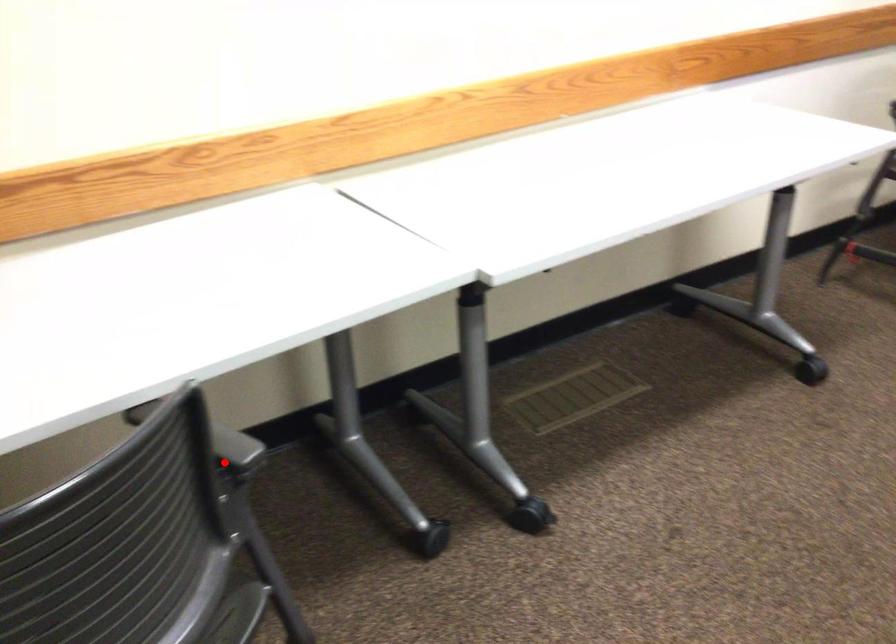
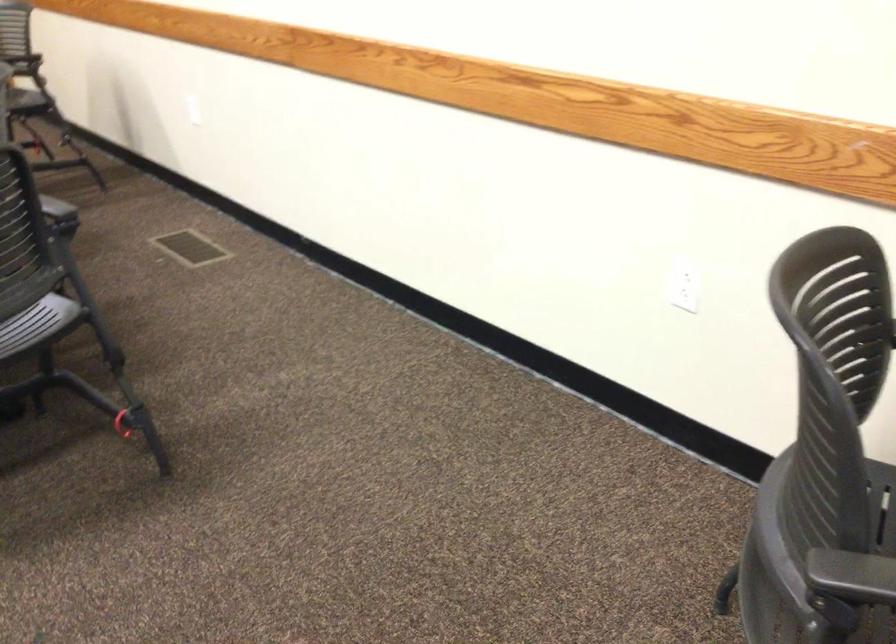
Question: A red point is marked in image1. In image2, is the corresponding 3D point closer to the camera or farther? Reply with the corresponding letter.

Choices:
 (A) The corresponding 3D point is closer.
 (B) The corresponding 3D point is farther.

Answer: (A)